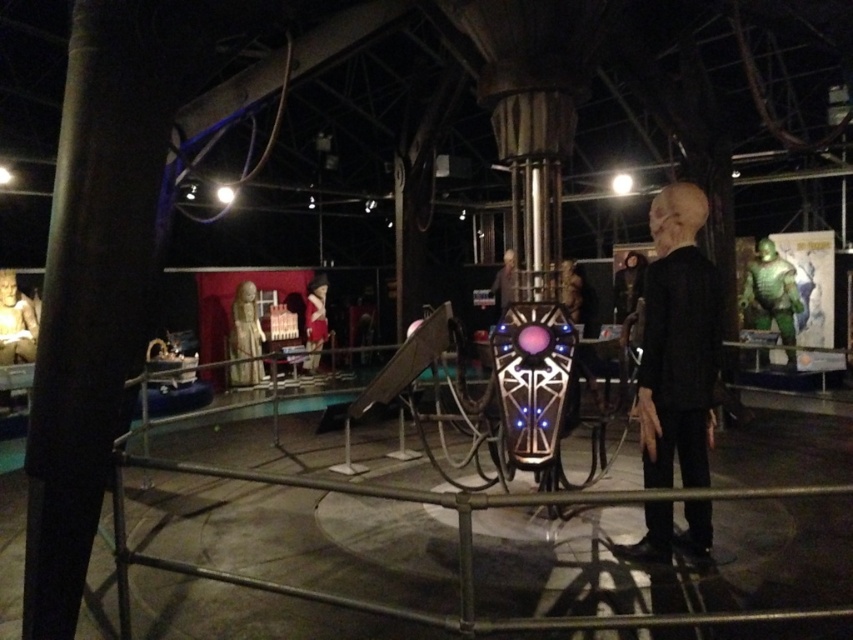
You are a visitor in the exhibition and want to take a photo of the matte gold statue at center and the matte black alien at center. Which one should you focus on first if you want to capture both in the same frame without moving your camera?

The matte gold statue at center is positioned under the matte black alien at center, so you should focus on the matte black alien at center first to ensure both are in the frame.

You are a visitor in the exhibition and want to take a photo of the matte white statue at left and the matte black alien at center. Which object should you focus on first to ensure both are in the frame?

You should focus on the matte white statue at left first because it is closer to you than the matte black alien at center, so adjusting the camera to include both would require framing starting from the closer object.